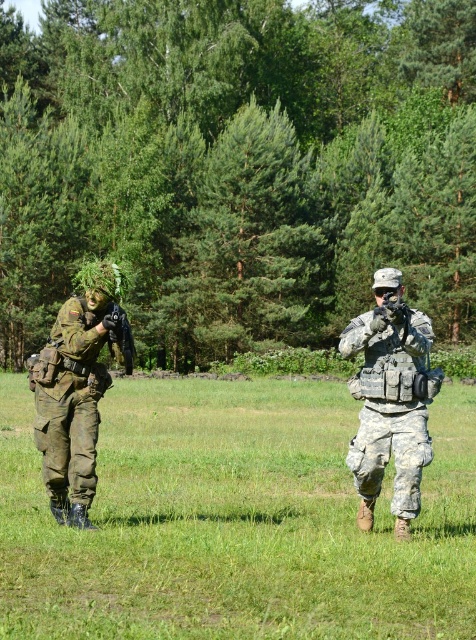
Question: Is camouflage fabric helmet at left positioned behind black matte rifle at center?

Choices:
 (A) yes
 (B) no

Answer: (B)

Question: Does camouflage fabric pants at center have a greater width compared to black matte rifle at center?

Choices:
 (A) yes
 (B) no

Answer: (A)

Question: Which point is closer to the camera taking this photo?

Choices:
 (A) (131, 333)
 (B) (405, 330)
 (C) (265, 404)
 (D) (59, 348)

Answer: (A)

Question: Which of these objects is positioned farthest from the camouflage fabric helmet at left?

Choices:
 (A) camouflage fabric uniform at center
 (B) black matte rifle at center

Answer: (A)

Question: Estimate the real-world distances between objects in this image. Which object is closer to the camouflage fabric uniform at center?

Choices:
 (A) camouflage fabric helmet at left
 (B) black matte rifle at center

Answer: (B)

Question: Is camouflage fabric pants at center smaller than black matte rifle at center?

Choices:
 (A) no
 (B) yes

Answer: (A)